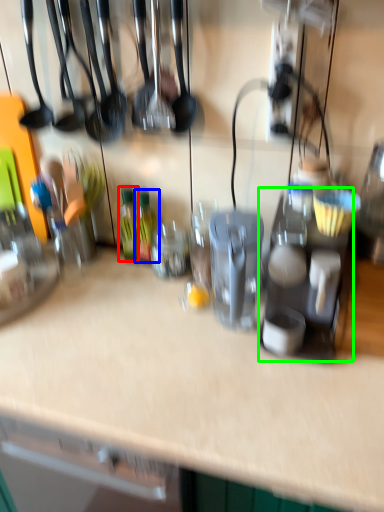
Question: Considering the real-world distances, which object is farthest from bottle (highlighted by a red box)? bottle (highlighted by a blue box) or appliance (highlighted by a green box)?

Choices:
 (A) bottle
 (B) appliance

Answer: (B)